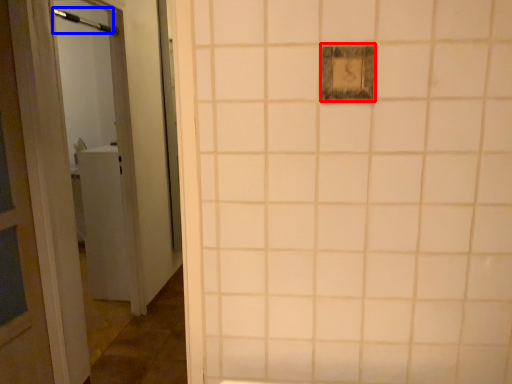
Question: Which of the following is the closest to the observer, light switch (highlighted by a red box) or shower (highlighted by a blue box)?

Choices:
 (A) light switch
 (B) shower

Answer: (A)